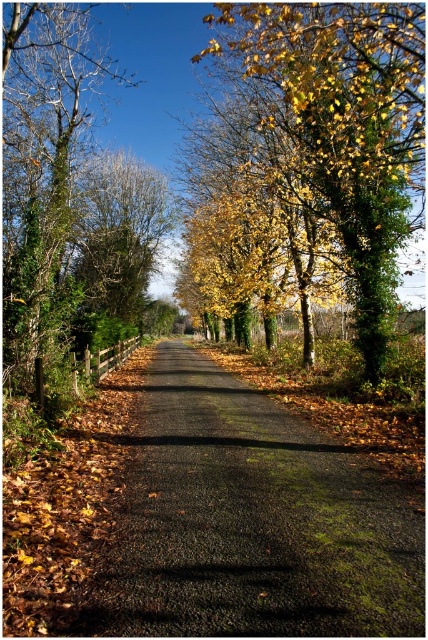
You are standing at the point marked as point (250, 522) on the image. What is the name of the object you are standing on?

You are standing on the dark asphalt road at center located at point (250, 522).